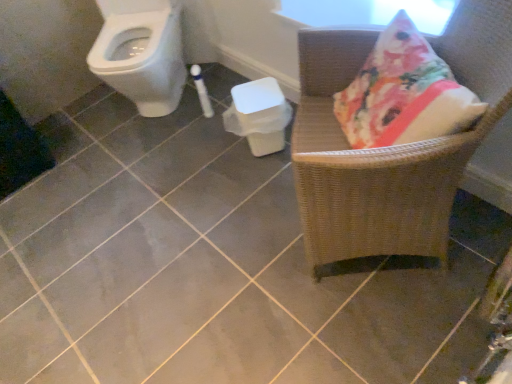
This screenshot has width=512, height=384. I want to click on free space to the left of white plastic potty at center, so click(x=210, y=155).